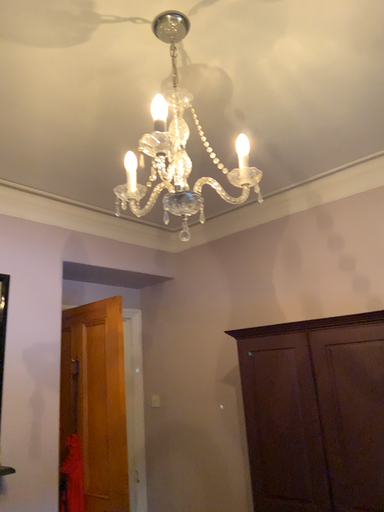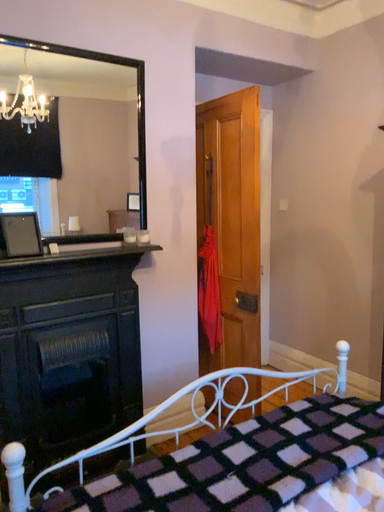
Question: How did the camera likely rotate when shooting the video?

Choices:
 (A) rotated right
 (B) rotated left

Answer: (B)